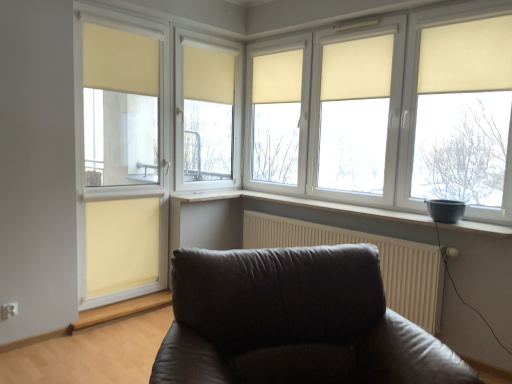
The height and width of the screenshot is (384, 512). Find the location of `vacant space situated above beige fabric curtain at lower left, the 6th curtain when ordered from right to left (from a real-world perspective)`. vacant space situated above beige fabric curtain at lower left, the 6th curtain when ordered from right to left (from a real-world perspective) is located at coordinates (121, 195).